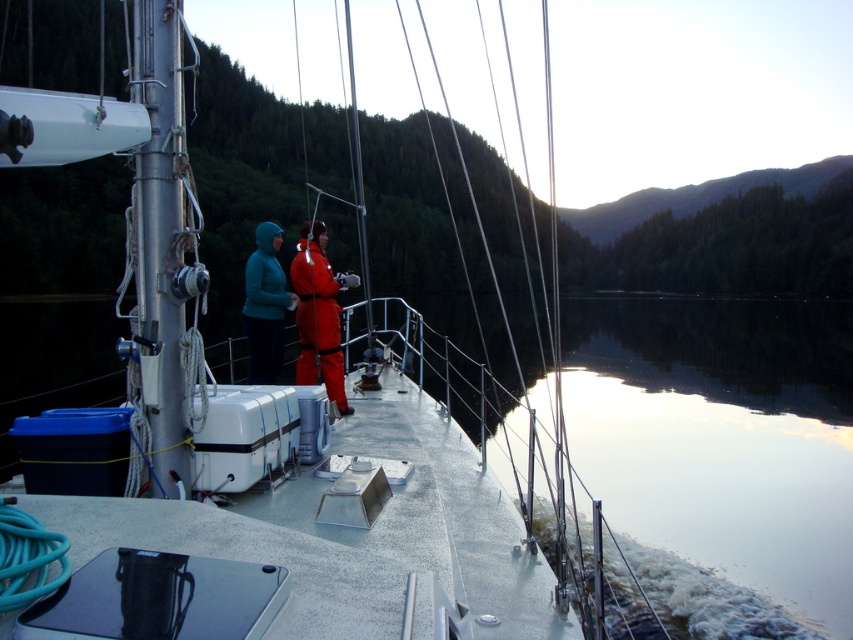
Question: Among these objects, which one is nearest to the camera?

Choices:
 (A) matte orange jumpsuit at center
 (B) clear water at lower right

Answer: (B)

Question: Can you confirm if clear water at lower right is bigger than matte blue jacket at center?

Choices:
 (A) no
 (B) yes

Answer: (B)

Question: Among these objects, which one is nearest to the camera?

Choices:
 (A) matte blue jacket at center
 (B) matte orange jumpsuit at center
 (C) clear water at lower right

Answer: (C)

Question: Which point is closer to the camera taking this photo?

Choices:
 (A) (310, 304)
 (B) (267, 224)

Answer: (A)

Question: Can you confirm if clear water at lower right is thinner than matte blue jacket at center?

Choices:
 (A) yes
 (B) no

Answer: (B)

Question: Is matte orange jumpsuit at center below matte blue jacket at center?

Choices:
 (A) yes
 (B) no

Answer: (B)